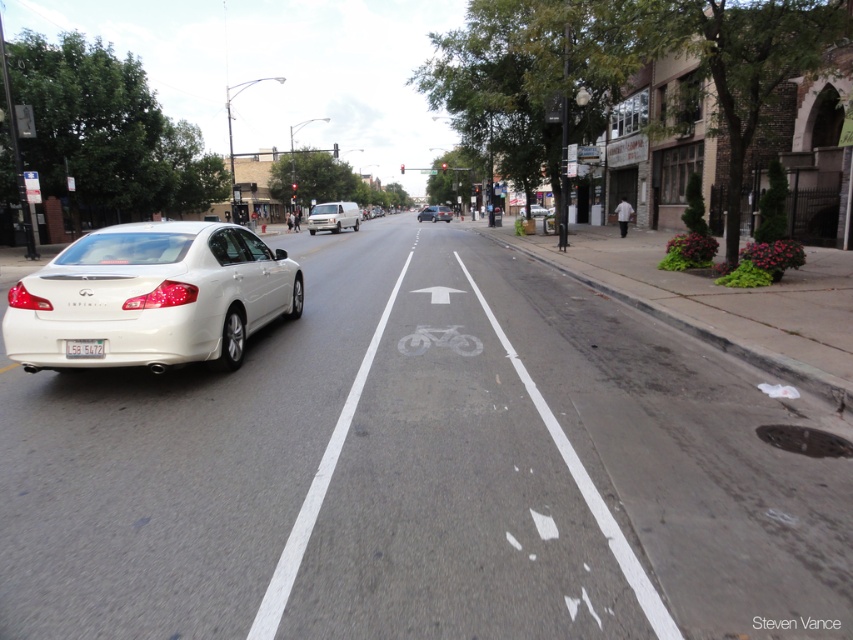
Question: Can you confirm if white glossy sedan at left is wider than white matte van at center?

Choices:
 (A) yes
 (B) no

Answer: (B)

Question: Is white plastic license plate at center wider than white matte sedan at center?

Choices:
 (A) yes
 (B) no

Answer: (B)

Question: Which object is positioned farthest from the white glossy sedan at left?

Choices:
 (A) white matte van at center
 (B) matte silver sedan at center
 (C) white plastic license plate at center
 (D) white matte sedan at center

Answer: (B)

Question: In this image, where is white glossy sedan at left located relative to white matte van at center?

Choices:
 (A) right
 (B) left

Answer: (A)

Question: Which point is closer to the camera?

Choices:
 (A) matte silver sedan at center
 (B) white glossy sedan at left
 (C) white matte sedan at center

Answer: (B)

Question: Based on their relative distances, which object is farther from the white glossy sedan at left?

Choices:
 (A) matte silver sedan at center
 (B) white matte van at center

Answer: (A)